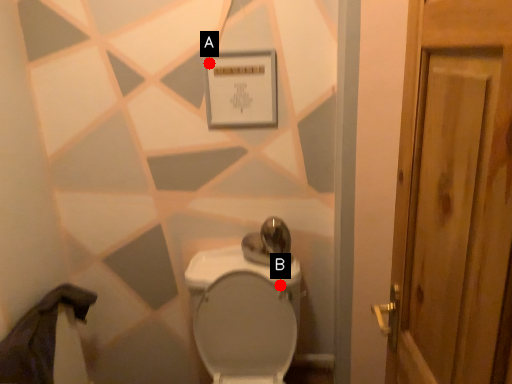
Question: Two points are circled on the image, labeled by A and B beside each circle. Which point appears farthest from the camera in this image?

Choices:
 (A) A is further
 (B) B is further

Answer: (B)